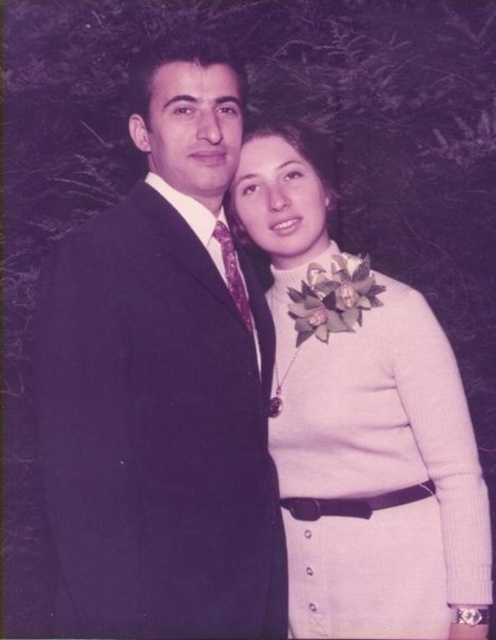
Is satin black suit at center to the right of white knitted dress at center from the viewer's perspective?

No, satin black suit at center is not to the right of white knitted dress at center.

Between satin black suit at center and white knitted dress at center, which one has more height?

Standing taller between the two is satin black suit at center.

Does point (229, 72) come farther from viewer compared to point (473, 493)?

Yes.

Locate an element on the screen. This screenshot has width=496, height=640. satin black suit at center is located at coordinates (163, 385).